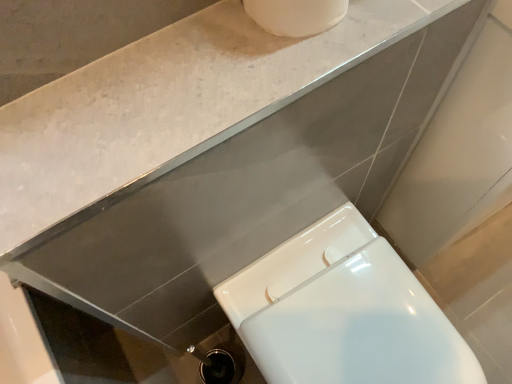
Question: Should I look upward or downward to see white glossy countertop at upper center?

Choices:
 (A) up
 (B) down

Answer: (A)

Question: From the image's perspective, is white glossy countertop at upper center over white glossy toilet at lower right?

Choices:
 (A) yes
 (B) no

Answer: (A)

Question: Can you confirm if white glossy countertop at upper center is thinner than white glossy toilet at lower right?

Choices:
 (A) no
 (B) yes

Answer: (B)

Question: From a real-world perspective, is white glossy countertop at upper center positioned under white glossy toilet at lower right based on gravity?

Choices:
 (A) yes
 (B) no

Answer: (B)

Question: Does white glossy countertop at upper center lie in front of white glossy toilet at lower right?

Choices:
 (A) no
 (B) yes

Answer: (B)

Question: Does white glossy countertop at upper center appear on the left side of white glossy toilet at lower right?

Choices:
 (A) no
 (B) yes

Answer: (B)

Question: Is the position of white glossy countertop at upper center more distant than that of white glossy toilet at lower right?

Choices:
 (A) no
 (B) yes

Answer: (A)

Question: Considering the relative sizes of white glossy toilet at lower right and white glossy countertop at upper center in the image provided, is white glossy toilet at lower right smaller than white glossy countertop at upper center?

Choices:
 (A) yes
 (B) no

Answer: (B)

Question: From the image's perspective, is white glossy toilet at lower right below white glossy countertop at upper center?

Choices:
 (A) yes
 (B) no

Answer: (A)

Question: Is white glossy toilet at lower right outside of white glossy countertop at upper center?

Choices:
 (A) yes
 (B) no

Answer: (A)

Question: Can you confirm if white glossy toilet at lower right is bigger than white glossy countertop at upper center?

Choices:
 (A) yes
 (B) no

Answer: (A)

Question: Does white glossy toilet at lower right have a greater height compared to white glossy countertop at upper center?

Choices:
 (A) yes
 (B) no

Answer: (A)

Question: Is white glossy toilet at lower right in front of white glossy countertop at upper center?

Choices:
 (A) no
 (B) yes

Answer: (A)

Question: In terms of size, does white glossy toilet at lower right appear bigger or smaller than white glossy countertop at upper center?

Choices:
 (A) big
 (B) small

Answer: (A)